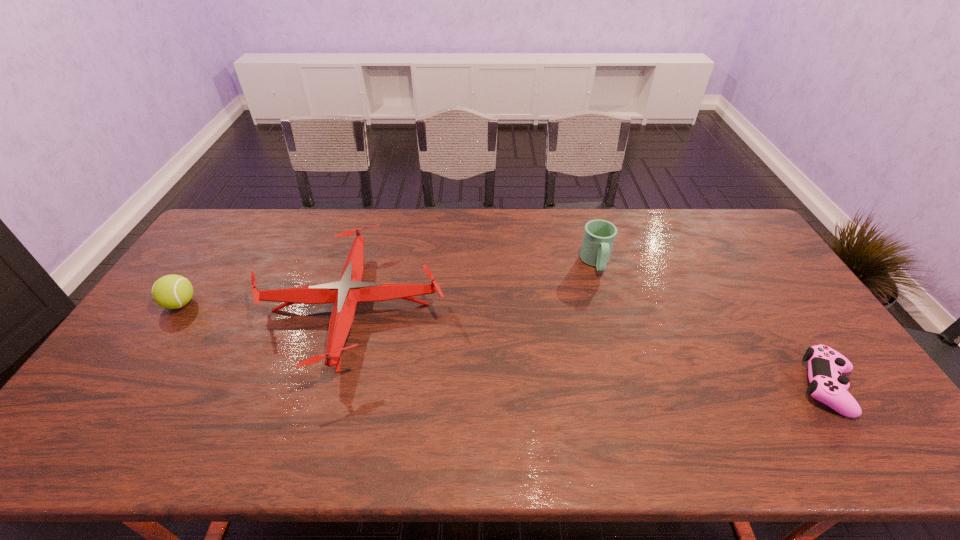
You are a GUI agent. You are given a task and a screenshot of the screen. Output one action in this format:
    pyautogui.click(x=<x>, y=<y>)
    Task: Click on the empty space that is in between the second object from left to right and the tennis ball
    This screenshot has height=540, width=960.
    Given the screenshot: What is the action you would take?
    pyautogui.click(x=266, y=306)

Find the location of a particular element. vacant space that is in between the control and the leftmost object is located at coordinates (504, 345).

Image resolution: width=960 pixels, height=540 pixels. Identify the location of free point between the leftmost object and the mug. (388, 283).

Image resolution: width=960 pixels, height=540 pixels. Identify the location of free spot between the second object from right to left and the third object from right to left. (473, 285).

Identify the location of free space between the leftmost object and the third object from right to left. (266, 306).

The height and width of the screenshot is (540, 960). What are the coordinates of `free space between the third object from right to left and the tennis ball` in the screenshot? It's located at (266, 306).

The height and width of the screenshot is (540, 960). I want to click on free spot between the tennis ball and the rightmost object, so click(504, 345).

Where is `unoccupied position between the drone and the control`? The width and height of the screenshot is (960, 540). unoccupied position between the drone and the control is located at coordinates (589, 347).

Where is `vacant space that's between the mug and the control`? vacant space that's between the mug and the control is located at coordinates (711, 325).

Identify which object is the closest to the third object from right to left. Please provide its 2D coordinates. Your answer should be formatted as a tuple, i.e. [(x, y)], where the tuple contains the x and y coordinates of a point satisfying the conditions above.

[(172, 291)]